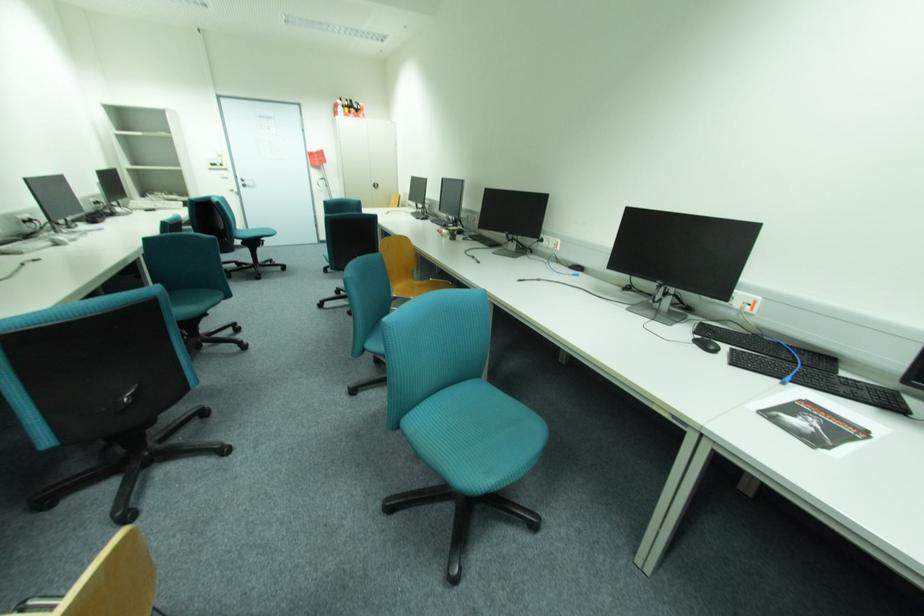
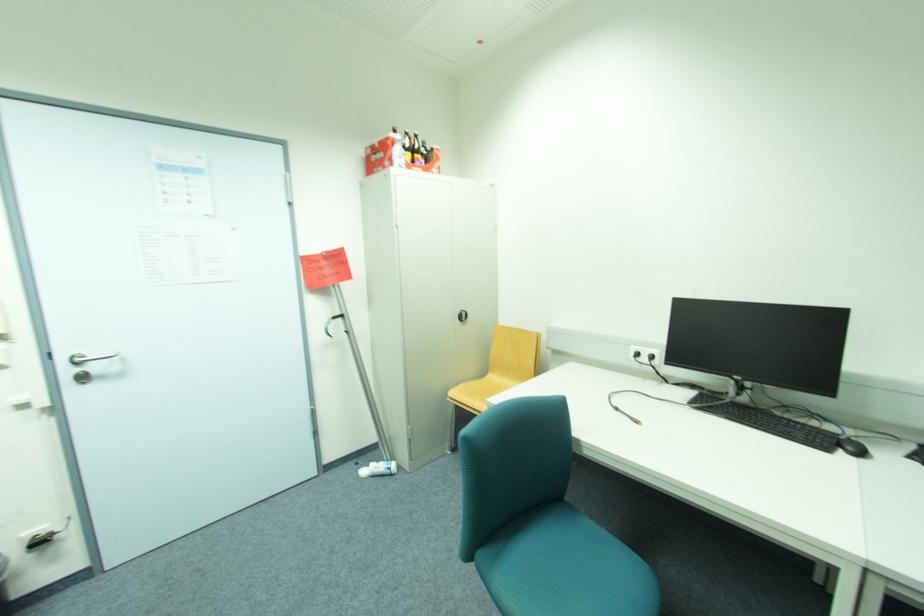
Where in the second image is the point corresponding to (x=248, y=183) from the first image?

(74, 371)